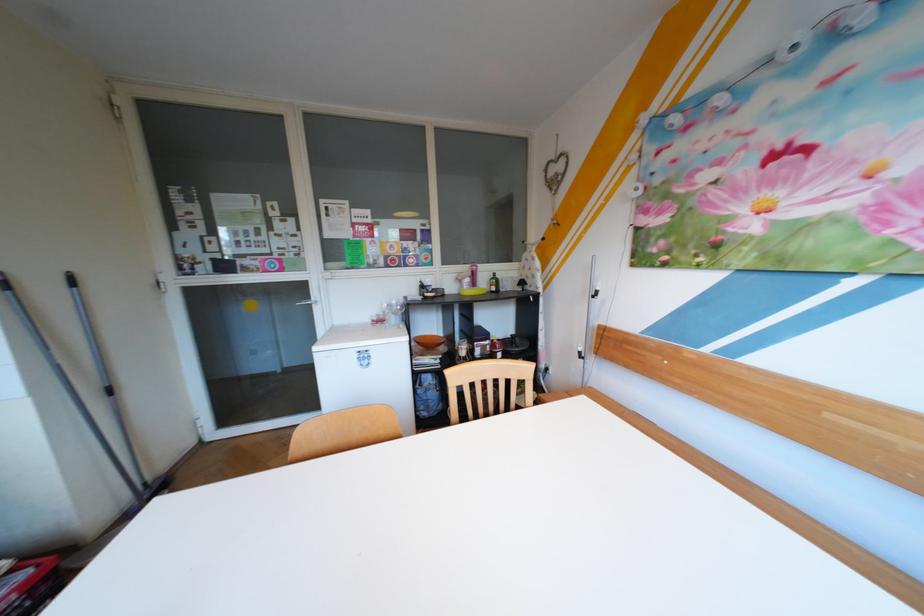
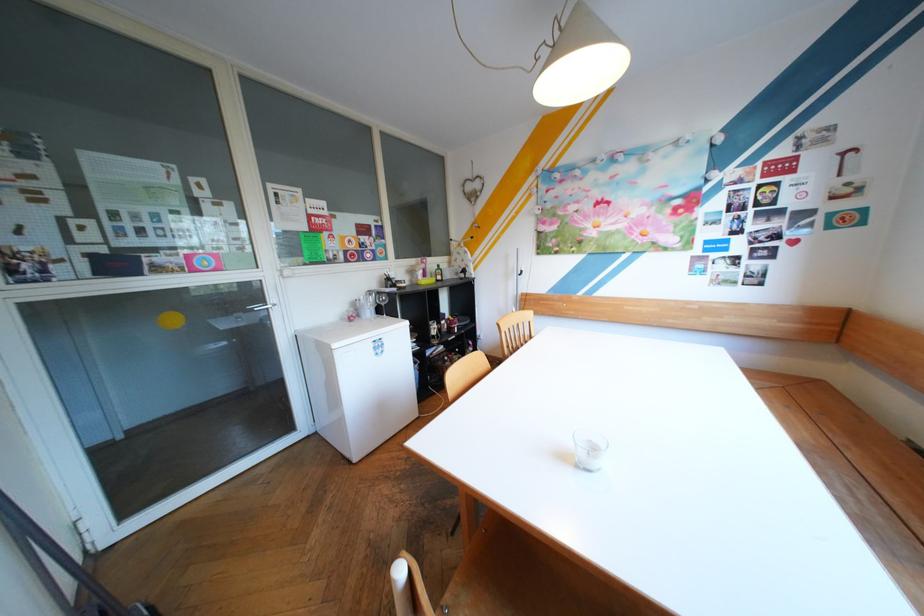
Question: I am providing you with two images of the same scene from different viewpoints. After the viewpoint changes to image2, which objects are now occluded?

Choices:
 (A) black USB plug
 (B) light bottle
 (C) dark bottle
 (D) brown ceramic bowl

Answer: (D)